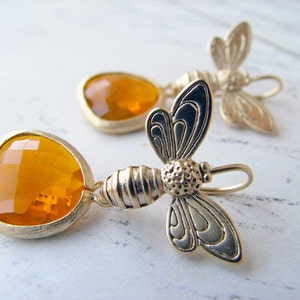
I want to click on background surface, so click(x=128, y=243).